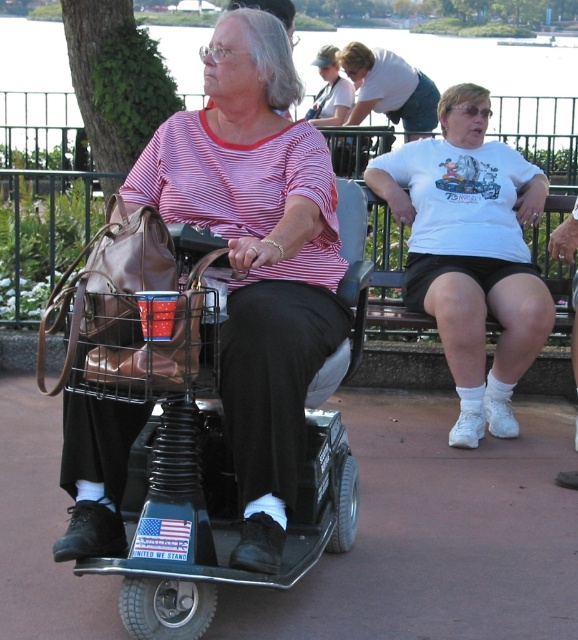
Question: Does matte black scooter at center lie behind white cotton t-shirt at upper right?

Choices:
 (A) yes
 (B) no

Answer: (B)

Question: Is transparent water at upper center to the right of matte white shirt at upper center from the viewer's perspective?

Choices:
 (A) yes
 (B) no

Answer: (B)

Question: Which point is farther to the camera?

Choices:
 (A) matte black scooter at center
 (B) white fabric shorts at lower right
 (C) matte white shirt at upper center
 (D) white cotton t-shirt at upper right

Answer: (C)

Question: Which of these objects is positioned farthest from the matte white shirt at upper center?

Choices:
 (A) matte black scooter at center
 (B) white fabric shorts at lower right

Answer: (A)

Question: Observing the image, what is the correct spatial positioning of transparent water at upper center in reference to white fabric shorts at lower right?

Choices:
 (A) below
 (B) above

Answer: (B)

Question: Which object is farther from the camera taking this photo?

Choices:
 (A) white cotton t-shirt at upper right
 (B) white fabric shorts at lower right

Answer: (B)